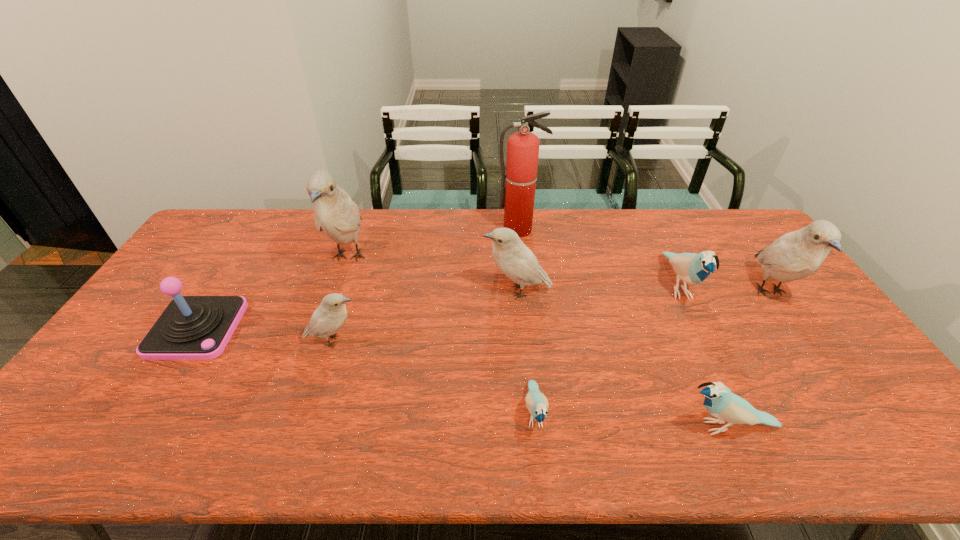
You are a GUI agent. You are given a task and a screenshot of the screen. Output one action in this format:
    pyautogui.click(x=<x>, y=<y>)
    Task: Click on the blank region between the red fire extinguisher and the joystick
    
    Given the screenshot: What is the action you would take?
    pyautogui.click(x=358, y=279)

The height and width of the screenshot is (540, 960). In order to click on vacant space that's between the fire extinguisher and the nearest white bird in this screenshot , I will do `click(426, 285)`.

Where is `empty location between the leftmost object and the biggest white bird`? empty location between the leftmost object and the biggest white bird is located at coordinates (273, 293).

In order to click on free spot between the eighth shortest object and the second biggest blue bird in this screenshot , I will do `click(539, 342)`.

Find the location of a particular element. blank region between the joystick and the tallest object is located at coordinates (358, 279).

The image size is (960, 540). I want to click on object identified as the sixth closest to the second biggest white bird, so click(x=329, y=317).

The width and height of the screenshot is (960, 540). I want to click on object that is the seventh closest one to the second biggest blue bird, so click(335, 214).

Identify the location of bird that is the third nearest to the farthest blue bird. This screenshot has height=540, width=960. (510, 254).

Image resolution: width=960 pixels, height=540 pixels. What are the coordinates of `bird that is the fifth closest one to the third biggest white bird` in the screenshot? It's located at (720, 402).

What are the coordinates of `white bird that can be found as the third closest to the smallest white bird` in the screenshot? It's located at (796, 255).